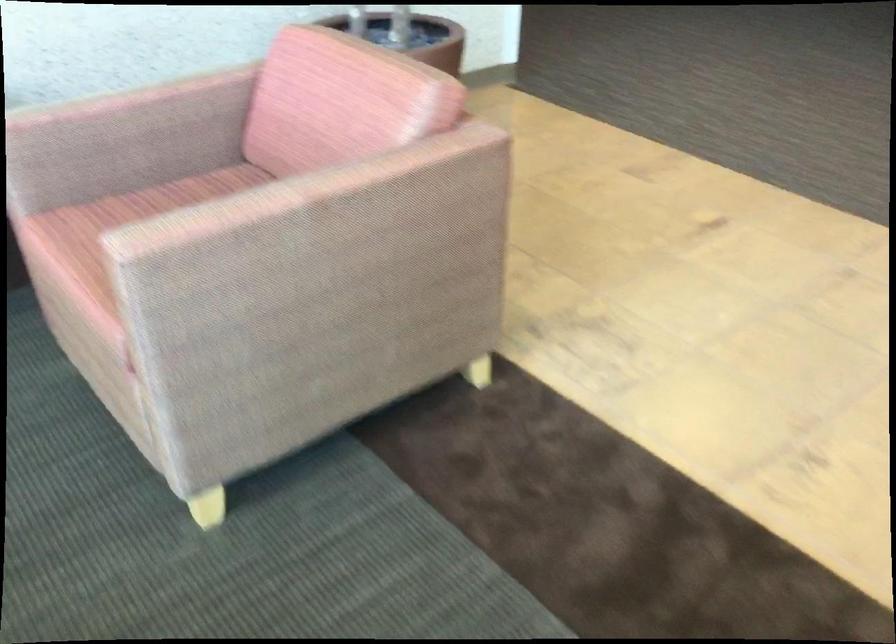
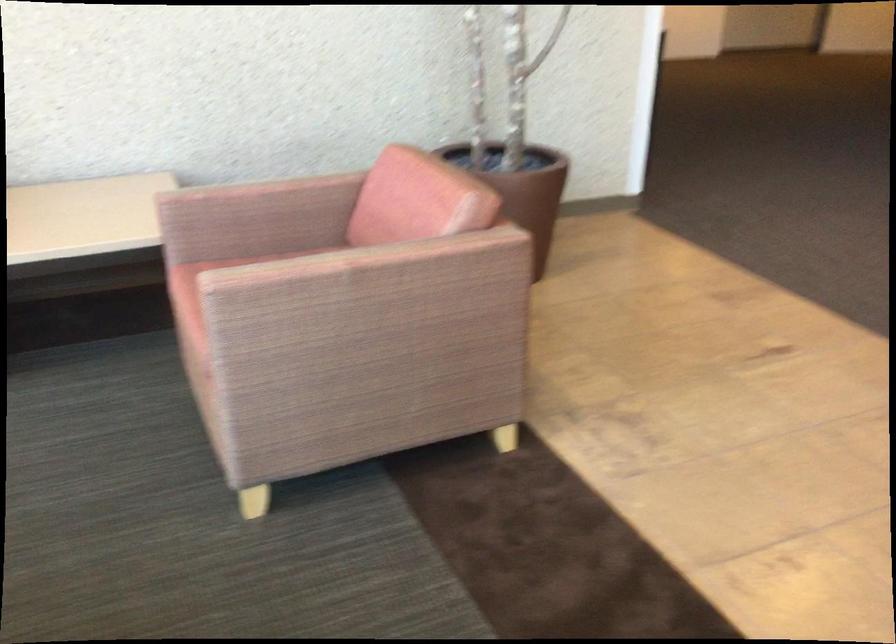
Which direction would the cameraman need to move to produce the second image?

The cameraman moved toward right, backward.